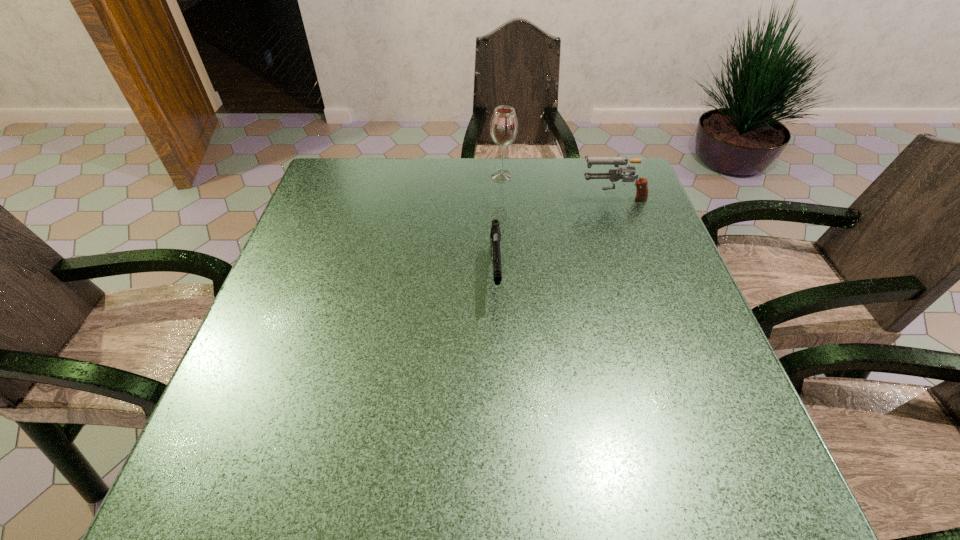
Locate an element on the screen. The height and width of the screenshot is (540, 960). free space located at the aiming end of the shorter gun is located at coordinates (498, 365).

Identify the location of wineglass that is positioned at the far edge. (504, 125).

Where is `gun that is at the far edge`? The height and width of the screenshot is (540, 960). gun that is at the far edge is located at coordinates (614, 175).

You are a GUI agent. You are given a task and a screenshot of the screen. Output one action in this format:
    pyautogui.click(x=<x>, y=<y>)
    Task: Click on the object present at the right edge
    
    Given the screenshot: What is the action you would take?
    [614, 175]

Identify the location of object that is at the far right corner. The width and height of the screenshot is (960, 540). (614, 175).

Locate an element on the screen. vacant space at the far edge is located at coordinates (510, 158).

Image resolution: width=960 pixels, height=540 pixels. What are the coordinates of `vacant space at the near edge of the desktop` in the screenshot? It's located at (403, 502).

At what (x,y) coordinates should I click in order to perform the action: click on free space at the left edge. Please return your answer as a coordinate pair (x, y). Image resolution: width=960 pixels, height=540 pixels. Looking at the image, I should click on (310, 299).

You are a GUI agent. You are given a task and a screenshot of the screen. Output one action in this format:
    pyautogui.click(x=<x>, y=<y>)
    Task: Click on the free location at the right edge of the desktop
    Image resolution: width=960 pixels, height=540 pixels.
    Given the screenshot: What is the action you would take?
    pyautogui.click(x=647, y=309)

The width and height of the screenshot is (960, 540). I want to click on blank area at the far left corner, so click(x=337, y=161).